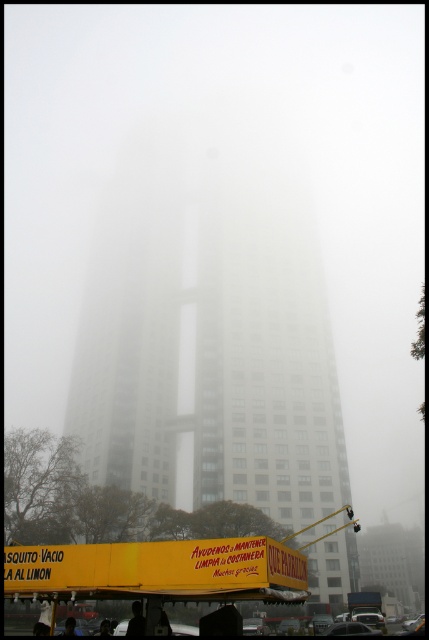
Question: Among these points, which one is nearest to the camera?

Choices:
 (A) pyautogui.click(x=174, y=332)
 (B) pyautogui.click(x=362, y=611)

Answer: (B)

Question: Which of the following is the farthest from the observer?

Choices:
 (A) (383, 618)
 (B) (205, 291)

Answer: (B)

Question: Considering the relative positions of white glass tower at center and yellow matte food truck at lower center in the image provided, where is white glass tower at center located with respect to yellow matte food truck at lower center?

Choices:
 (A) left
 (B) right

Answer: (A)

Question: Can you confirm if white glass tower at center is positioned to the right of yellow matte food truck at lower center?

Choices:
 (A) yes
 (B) no

Answer: (B)

Question: Can you confirm if white glass tower at center is wider than yellow matte food truck at lower center?

Choices:
 (A) yes
 (B) no

Answer: (A)

Question: Which object appears closest to the camera in this image?

Choices:
 (A) white glass tower at center
 (B) yellow matte food truck at lower center

Answer: (B)